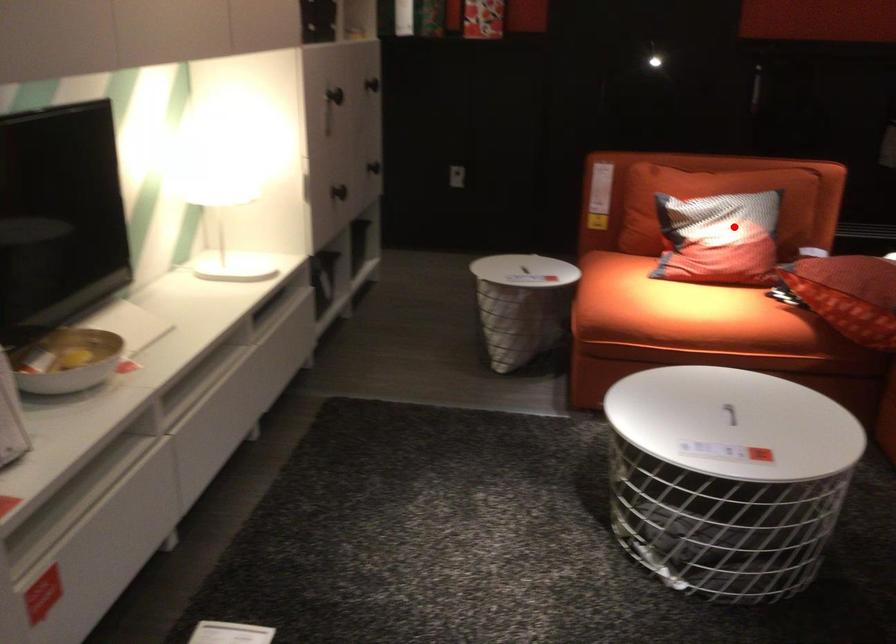
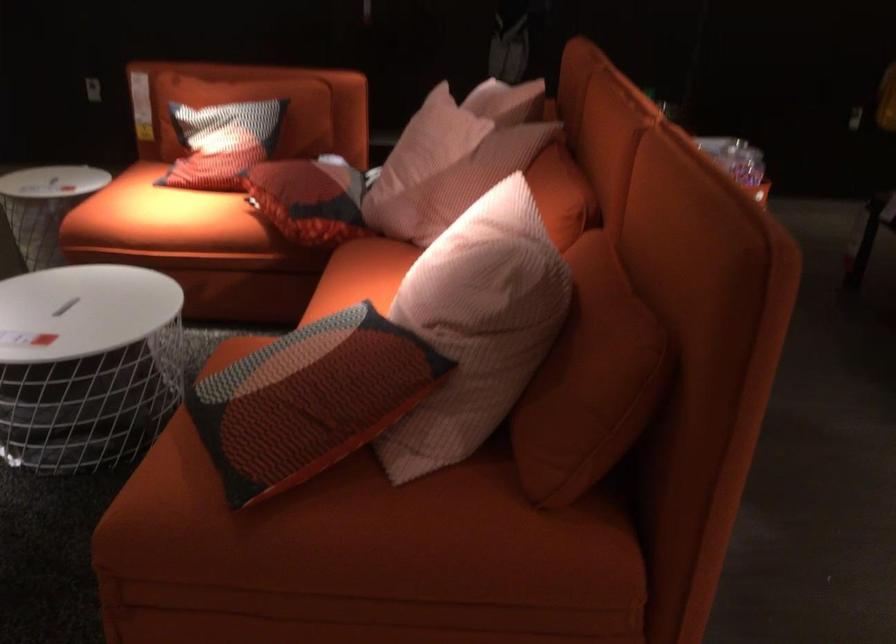
Question: I am providing you with two images of the same scene from different viewpoints. A red point is shown in image1. For the corresponding object point in image2, is it positioned nearer or farther from the camera?

Choices:
 (A) Nearer
 (B) Farther

Answer: (B)